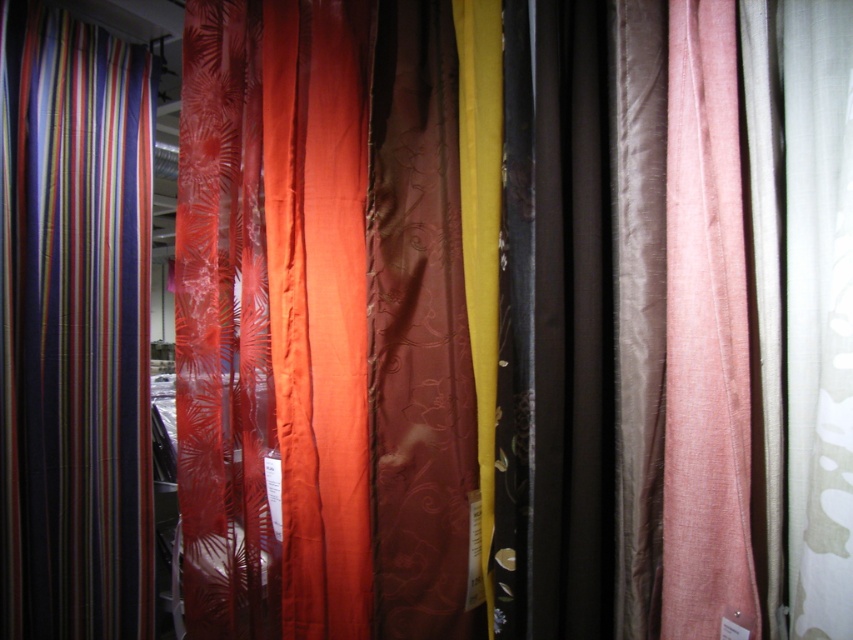
You are a decorator planning to hang two curtains in a sunroom. You have the brown satin curtain at center and the pink sheer curtain at right. To allow maximum sunlight into the room, which curtain should be placed in front?

The pink sheer curtain at right should be placed in front of the brown satin curtain at center because sheer fabrics allow more light to pass through, maximizing sunlight in the room.

You are an interior designer selecting curtains for a client who wants to maximize natural light while maintaining privacy. The client prefers the orange curtain but is concerned about its height. Given the scene description, can the satin orange curtain at center be paired with the brown satin curtain at center in a way that allows the orange one to cover the window fully while still letting light through?

The satin orange curtain at center is taller than the brown satin curtain at center, so it can fully cover the window while still allowing light through since it is taller. The brown satin curtain at center, being shorter, can be placed behind to let more light in or in front for partial coverage, depending on the desired balance between privacy and light.